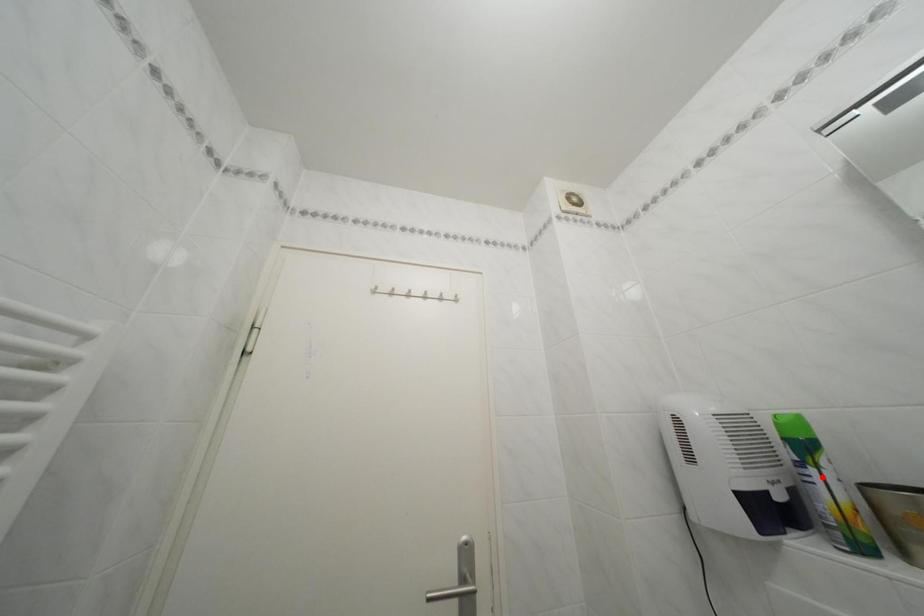
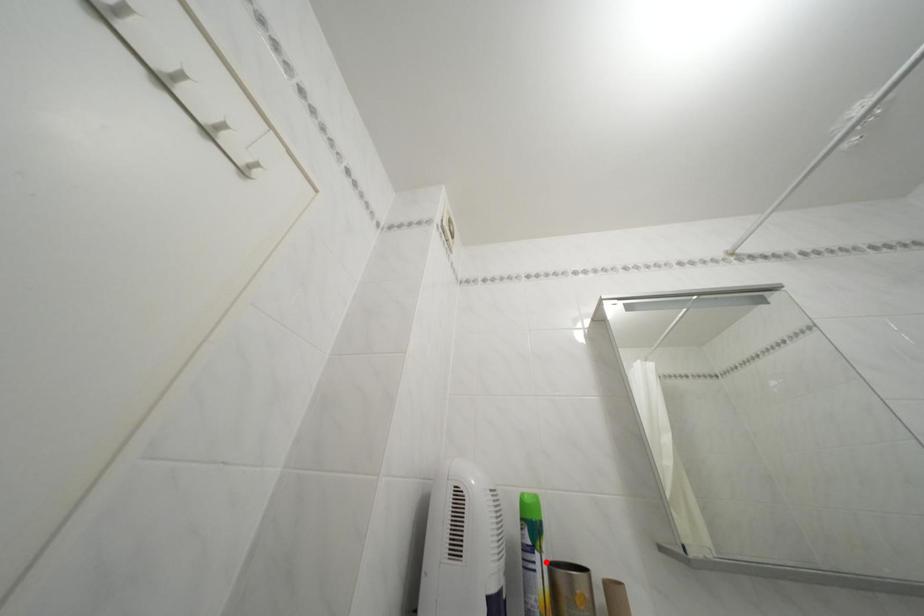
I am providing you with two images of the same scene from different viewpoints. A red point is marked on the first image and another point is marked on the second image. Do the highlighted points in image1 and image2 indicate the same real-world spot?

Yes